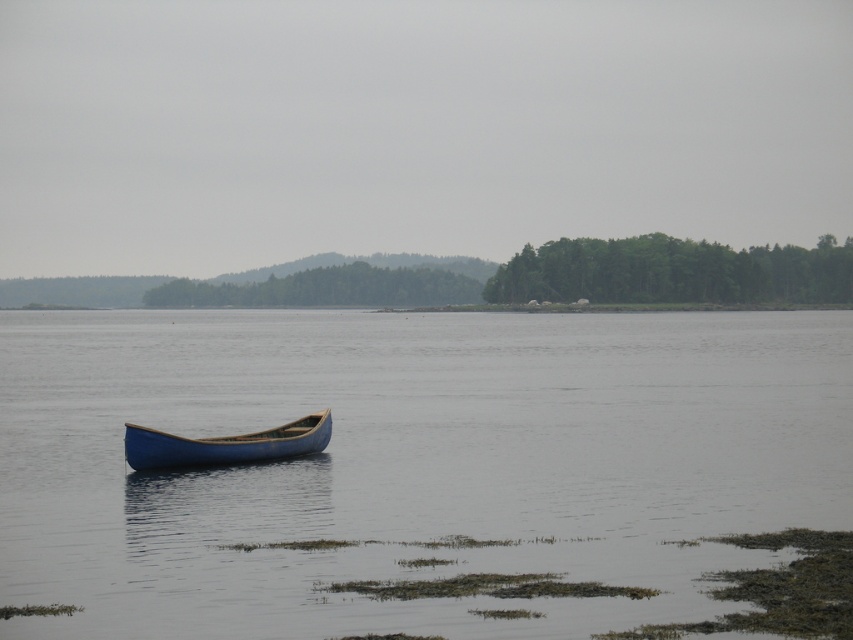
Between blue smooth water at center and blue wooden canoe at center, which one is positioned higher?

blue smooth water at center is higher up.

Who is positioned more to the right, blue smooth water at center or blue wooden canoe at center?

blue smooth water at center

Locate an element on the screen. This screenshot has width=853, height=640. blue smooth water at center is located at coordinates (410, 461).

Locate an element on the screen. This screenshot has width=853, height=640. blue smooth water at center is located at coordinates (410, 461).